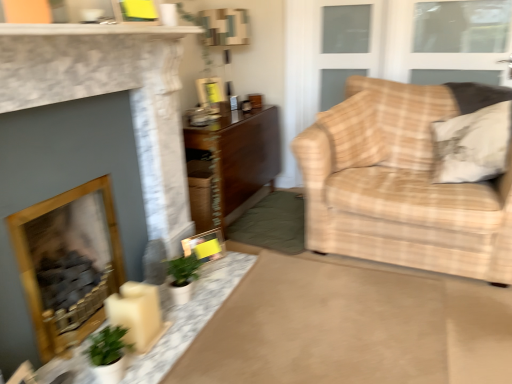
You are a GUI agent. You are given a task and a screenshot of the screen. Output one action in this format:
    pyautogui.click(x=<x>, y=<y>)
    Task: Click on the vacant area that is situated to the right of white marble table at center, the 1th table positioned from the front
    
    Given the screenshot: What is the action you would take?
    pyautogui.click(x=301, y=316)